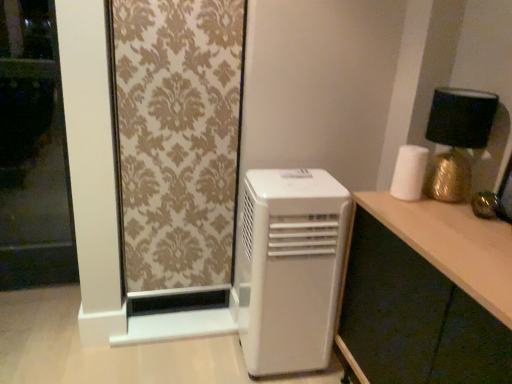
Question: Does gold damask fabric at upper left have a lesser height compared to wooden desk at right?

Choices:
 (A) yes
 (B) no

Answer: (B)

Question: Is gold damask fabric at upper left in front of wooden desk at right?

Choices:
 (A) yes
 (B) no

Answer: (B)

Question: Is gold damask fabric at upper left wider than wooden desk at right?

Choices:
 (A) yes
 (B) no

Answer: (B)

Question: From the image's perspective, does gold damask fabric at upper left appear lower than wooden desk at right?

Choices:
 (A) yes
 (B) no

Answer: (B)

Question: Is gold damask fabric at upper left not within wooden desk at right?

Choices:
 (A) yes
 (B) no

Answer: (A)

Question: Is gold damask fabric at upper left behind wooden desk at right?

Choices:
 (A) no
 (B) yes

Answer: (B)

Question: Is wooden desk at right taller than white matte paper towel at right?

Choices:
 (A) yes
 (B) no

Answer: (A)

Question: Is wooden desk at right smaller than white matte paper towel at right?

Choices:
 (A) yes
 (B) no

Answer: (B)

Question: Is wooden desk at right with white matte paper towel at right?

Choices:
 (A) no
 (B) yes

Answer: (A)

Question: Is wooden desk at right oriented away from white matte paper towel at right?

Choices:
 (A) yes
 (B) no

Answer: (B)

Question: Could white matte paper towel at right be considered to be inside wooden desk at right?

Choices:
 (A) no
 (B) yes

Answer: (A)

Question: From the image's perspective, is wooden desk at right beneath white matte paper towel at right?

Choices:
 (A) yes
 (B) no

Answer: (A)

Question: Is white matte paper towel at right oriented away from gold metallic table lamp at upper right?

Choices:
 (A) yes
 (B) no

Answer: (A)